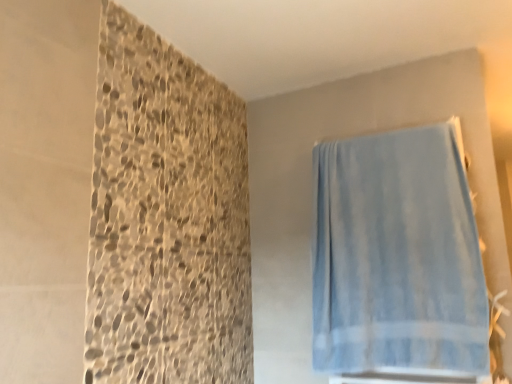
Describe the element at coordinates (397, 256) in the screenshot. I see `blue plush towel at upper right` at that location.

Find the location of a particular element. Image resolution: width=512 pixels, height=384 pixels. blue plush towel at upper right is located at coordinates (397, 256).

Find the location of `blue plush towel at upper right`. blue plush towel at upper right is located at coordinates (397, 256).